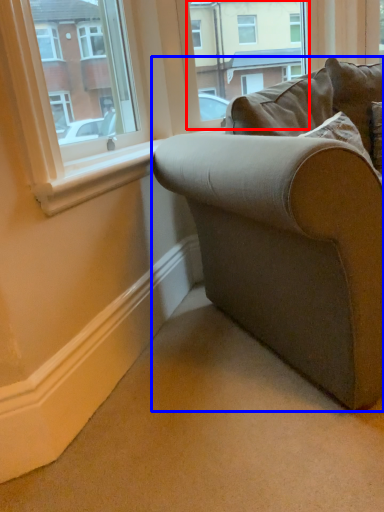
Question: Which point is further to the camera, window frame (highlighted by a red box) or studio couch (highlighted by a blue box)?

Choices:
 (A) window frame
 (B) studio couch

Answer: (A)